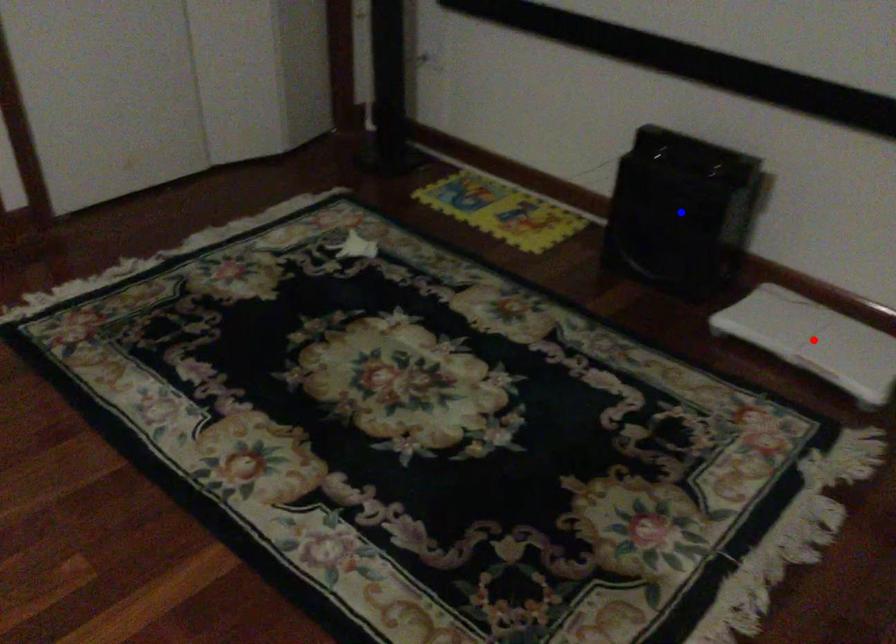
Question: Two points are marked on the image. Which point is closer to the camera?

Choices:
 (A) Blue point is closer.
 (B) Red point is closer.

Answer: (B)